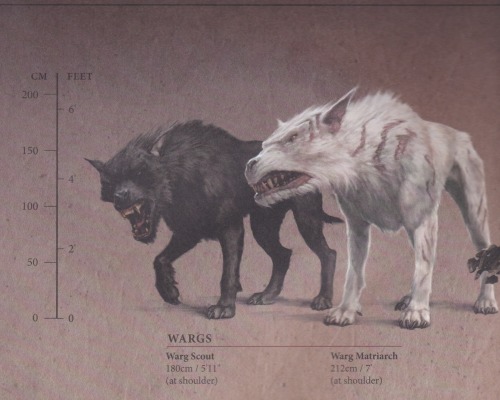
Where is `white fur`? This screenshot has height=400, width=500. white fur is located at coordinates (377, 150).